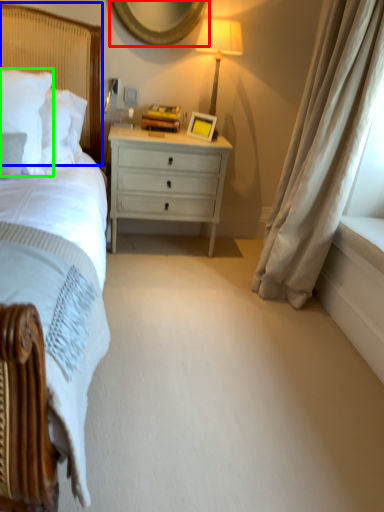
Question: Considering the real-world distances, which object is closest to mirror (highlighted by a red box)? headboard (highlighted by a blue box) or pillow (highlighted by a green box).

Choices:
 (A) headboard
 (B) pillow

Answer: (A)